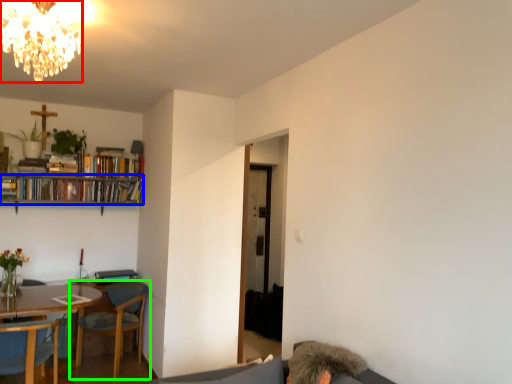
Question: Which object is the farthest from lamp (highlighted by a red box)? Choose among these: book (highlighted by a blue box) or chair (highlighted by a green box).

Choices:
 (A) book
 (B) chair

Answer: (A)